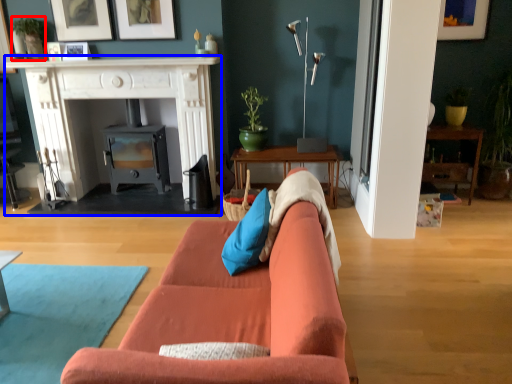
Question: Among these objects, which one is farthest to the camera, houseplant (highlighted by a red box) or fireplace (highlighted by a blue box)?

Choices:
 (A) houseplant
 (B) fireplace

Answer: (A)